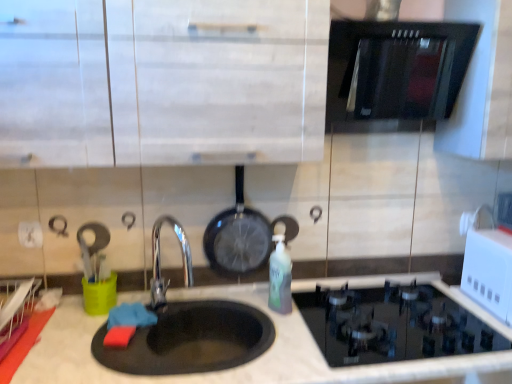
Question: Is white glossy microwave at upper right shorter than black matte pizza pan at lower center?

Choices:
 (A) yes
 (B) no

Answer: (B)

Question: Is white glossy microwave at upper right wider than black matte pizza pan at lower center?

Choices:
 (A) yes
 (B) no

Answer: (B)

Question: Does white glossy microwave at upper right turn towards black matte pizza pan at lower center?

Choices:
 (A) no
 (B) yes

Answer: (A)

Question: Does white glossy microwave at upper right have a smaller size compared to black matte pizza pan at lower center?

Choices:
 (A) yes
 (B) no

Answer: (A)

Question: Is white glossy microwave at upper right oriented away from black matte pizza pan at lower center?

Choices:
 (A) no
 (B) yes

Answer: (A)

Question: Is black matte pizza pan at lower center a part of white glossy microwave at upper right?

Choices:
 (A) yes
 (B) no

Answer: (B)

Question: Is black glass oven at upper right oriented towards translucent green bottle at center?

Choices:
 (A) yes
 (B) no

Answer: (B)

Question: Is black glass oven at upper right taller than translucent green bottle at center?

Choices:
 (A) no
 (B) yes

Answer: (B)

Question: Is black glass oven at upper right closer to camera compared to translucent green bottle at center?

Choices:
 (A) no
 (B) yes

Answer: (B)

Question: Is the position of black glass oven at upper right more distant than that of translucent green bottle at center?

Choices:
 (A) no
 (B) yes

Answer: (A)

Question: From a real-world perspective, is black glass oven at upper right on top of translucent green bottle at center?

Choices:
 (A) yes
 (B) no

Answer: (A)

Question: Is black glass oven at upper right outside translucent green bottle at center?

Choices:
 (A) no
 (B) yes

Answer: (B)

Question: Are black glass oven at upper right and white glossy microwave at upper right far apart?

Choices:
 (A) no
 (B) yes

Answer: (A)